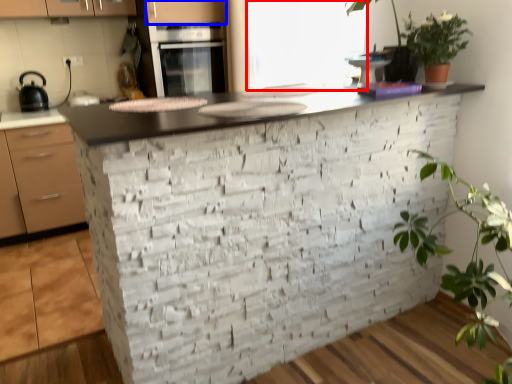
Question: Which object is closer to the camera taking this photo, window screen (highlighted by a red box) or cabinetry (highlighted by a blue box)?

Choices:
 (A) window screen
 (B) cabinetry

Answer: (A)